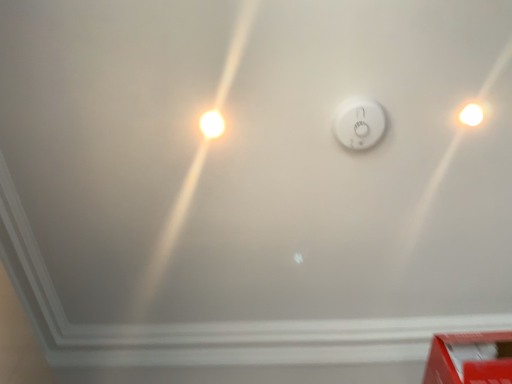
Question: Are red cardboard box at lower right and white glossy light bulb at upper right, the 1th light bulb in the right-to-left sequence, located far from each other?

Choices:
 (A) no
 (B) yes

Answer: (A)

Question: Is red cardboard box at lower right positioned before white glossy light bulb at upper right, the 1th light bulb in the right-to-left sequence?

Choices:
 (A) no
 (B) yes

Answer: (B)

Question: Is red cardboard box at lower right thinner than white glossy light bulb at upper right, the 1th light bulb in the right-to-left sequence?

Choices:
 (A) no
 (B) yes

Answer: (A)

Question: Are red cardboard box at lower right and white glossy light bulb at upper right, the 1th light bulb in the right-to-left sequence, making contact?

Choices:
 (A) yes
 (B) no

Answer: (B)

Question: Is white glossy light bulb at upper right, marked as the second light bulb in a left-to-right arrangement, a part of red cardboard box at lower right?

Choices:
 (A) no
 (B) yes

Answer: (A)

Question: Considering the relative sizes of red cardboard box at lower right and white glossy light bulb at upper right, marked as the second light bulb in a left-to-right arrangement, in the image provided, is red cardboard box at lower right taller than white glossy light bulb at upper right, marked as the second light bulb in a left-to-right arrangement,?

Choices:
 (A) yes
 (B) no

Answer: (A)

Question: Is white glossy light bulb at upper right, marked as the second light bulb in a left-to-right arrangement, closer to camera compared to white glossy light bulb at upper left, placed as the second light bulb when sorted from right to left?

Choices:
 (A) no
 (B) yes

Answer: (B)

Question: Considering the relative positions of white glossy light bulb at upper right, the 1th light bulb in the right-to-left sequence, and white glossy light bulb at upper left, the 1th light bulb from the left, in the image provided, is white glossy light bulb at upper right, the 1th light bulb in the right-to-left sequence, to the right of white glossy light bulb at upper left, the 1th light bulb from the left, from the viewer's perspective?

Choices:
 (A) yes
 (B) no

Answer: (A)

Question: Is white glossy light bulb at upper right, the 1th light bulb in the right-to-left sequence, far from white glossy light bulb at upper left, the 1th light bulb from the left?

Choices:
 (A) no
 (B) yes

Answer: (A)

Question: Does white glossy light bulb at upper right, the 1th light bulb in the right-to-left sequence, turn towards white glossy light bulb at upper left, placed as the second light bulb when sorted from right to left?

Choices:
 (A) yes
 (B) no

Answer: (B)

Question: Considering the relative sizes of white glossy light bulb at upper right, marked as the second light bulb in a left-to-right arrangement, and white glossy light bulb at upper left, placed as the second light bulb when sorted from right to left, in the image provided, is white glossy light bulb at upper right, marked as the second light bulb in a left-to-right arrangement, bigger than white glossy light bulb at upper left, placed as the second light bulb when sorted from right to left,?

Choices:
 (A) yes
 (B) no

Answer: (A)

Question: Does white glossy light bulb at upper right, the 1th light bulb in the right-to-left sequence, appear on the left side of white glossy light bulb at upper left, placed as the second light bulb when sorted from right to left?

Choices:
 (A) no
 (B) yes

Answer: (A)

Question: From a real-world perspective, does white plastic smoke detector at center sit lower than white glossy light bulb at upper right, marked as the second light bulb in a left-to-right arrangement?

Choices:
 (A) no
 (B) yes

Answer: (B)